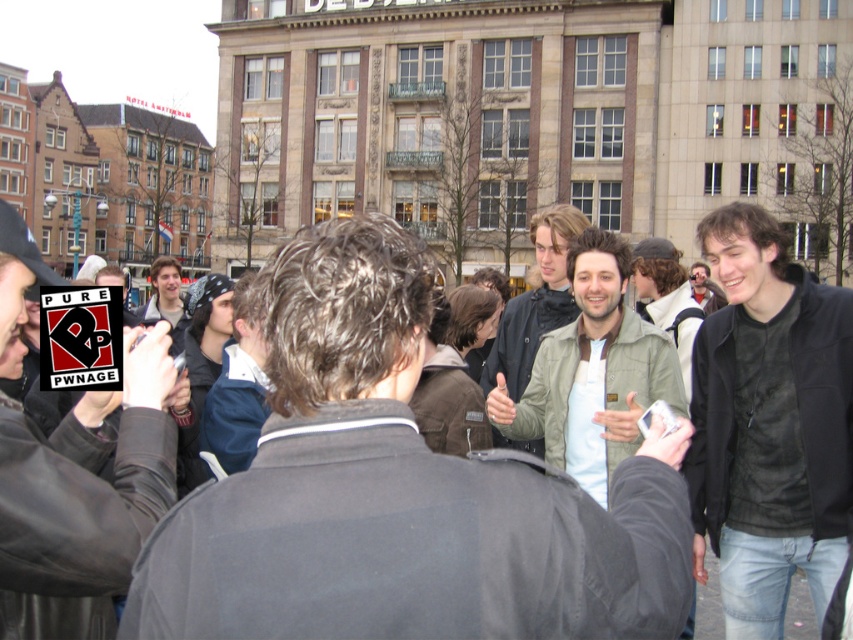
Question: Among these points, which one is farthest from the camera?

Choices:
 (A) (782, 289)
 (B) (529, 356)
 (C) (323, 317)
 (D) (578, 301)

Answer: (B)

Question: Which of the following is the farthest from the observer?

Choices:
 (A) olive-green jacket at center
 (B) black leather jacket at center
 (C) green fabric jacket at center

Answer: (A)

Question: Considering the relative positions of black leather jacket at center and olive-green jacket at center in the image provided, where is black leather jacket at center located with respect to olive-green jacket at center?

Choices:
 (A) above
 (B) below

Answer: (B)

Question: Does green fabric jacket at center appear on the left side of black leather jacket at center?

Choices:
 (A) no
 (B) yes

Answer: (B)

Question: Is green fabric jacket at center smaller than black leather jacket at center?

Choices:
 (A) yes
 (B) no

Answer: (B)

Question: Among these objects, which one is farthest from the camera?

Choices:
 (A) olive-green jacket at center
 (B) black leather jacket at center
 (C) light brown jacket at center
 (D) green fabric jacket at center

Answer: (C)